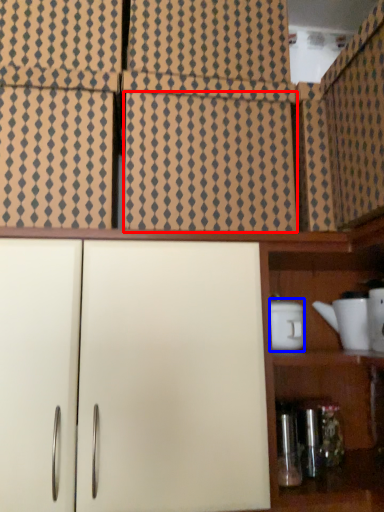
Question: Among these objects, which one is farthest to the camera, tile (highlighted by a red box) or appliance (highlighted by a blue box)?

Choices:
 (A) tile
 (B) appliance

Answer: (B)